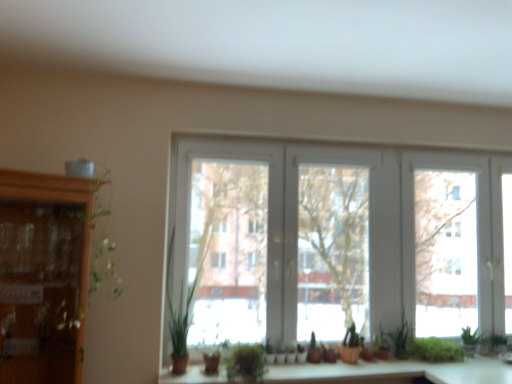
Identify the location of matte wood counter top at center. Image resolution: width=512 pixels, height=384 pixels. (394, 372).

Measure the distance between green leafy plant at center, which ranks as the sixth plant in right-to-left order, and camera.

green leafy plant at center, which ranks as the sixth plant in right-to-left order, is 8.16 feet away from camera.

How much space does green matte plant at lower right, marked as the second plant in a right-to-left arrangement, occupy vertically?

green matte plant at lower right, marked as the second plant in a right-to-left arrangement, is 13.49 inches in height.

In order to face green matte plant at lower right, acting as the fifth plant starting from the left, should I rotate leftwards or rightwards?

You should look right and rotate roughly 18.867 degrees.

Image resolution: width=512 pixels, height=384 pixels. In order to click on green matte plant at lower right, which appears as the 3th plant when viewed from the right in this screenshot , I will do `click(381, 344)`.

In the scene shown: What is the approximate height of green matte plant at lower right, which appears as the 3th plant when viewed from the right?

green matte plant at lower right, which appears as the 3th plant when viewed from the right, is 9.41 inches tall.

At what (x,y) coordinates should I click in order to perform the action: click on green matte plant at center, which appears as the 4th plant when viewed from the right. Please return your answer as a coordinate pair (x, y). The height and width of the screenshot is (384, 512). Looking at the image, I should click on (328, 354).

Describe the element at coordinates (436, 350) in the screenshot. I see `green leafy plant at lower right, which appears as the sixth plant when viewed from the left` at that location.

You are a GUI agent. You are given a task and a screenshot of the screen. Output one action in this format:
    pyautogui.click(x=<x>, y=<y>)
    Task: Click on the matte wood counter top at center
    This screenshot has width=512, height=384.
    Given the screenshot: What is the action you would take?
    pyautogui.click(x=394, y=372)

What's the angular difference between white plastic window at center and green matte plant at center, positioned as the third plant in left-to-right order,'s facing directions?

The angle between the facing direction of white plastic window at center and the facing direction of green matte plant at center, positioned as the third plant in left-to-right order, is 0.00143 degrees.

Considering the relative sizes of white plastic window at center and green matte plant at center, positioned as the third plant in left-to-right order, in the image provided, is white plastic window at center bigger than green matte plant at center, positioned as the third plant in left-to-right order,?

Yes, white plastic window at center is bigger than green matte plant at center, positioned as the third plant in left-to-right order.

Locate an element on the screen. This screenshot has height=384, width=512. the 6th plant below the white plastic window at center (from a real-world perspective) is located at coordinates (328, 354).

Looking at this image, do you think white plastic window at center is within green matte plant at center, the fifth plant in the right-to-left sequence, or outside of it?

white plastic window at center lies outside green matte plant at center, the fifth plant in the right-to-left sequence.

Which object is positioned more to the left, white plastic window at center or green matte plant at center, which ranks as the 2th plant in left-to-right order?

Positioned to the left is green matte plant at center, which ranks as the 2th plant in left-to-right order.

Is white plastic window at center bigger or smaller than green matte plant at center, which ranks as the 2th plant in left-to-right order?

In the image, white plastic window at center appears to be larger than green matte plant at center, which ranks as the 2th plant in left-to-right order.

From a real-world perspective, who is located lower, white plastic window at center or green matte plant at center, which ranks as the 2th plant in left-to-right order?

In real-world perspective, green matte plant at center, which ranks as the 2th plant in left-to-right order, is lower.

Looking at this image, could you tell me if white plastic window at center is facing green matte plant at center?

Yes, white plastic window at center is oriented towards green matte plant at center.

From a real-world perspective, which is physically below, white plastic window at center or green matte plant at center?

green matte plant at center.

Considering their positions, is white plastic window at center located in front of or behind green matte plant at center?

In the image, white plastic window at center appears behind green matte plant at center.

Does green matte plant at lower right, which appears as the 3th plant when viewed from the right, have a greater width compared to green matte plant at center?

In fact, green matte plant at lower right, which appears as the 3th plant when viewed from the right, might be narrower than green matte plant at center.

Is point (382, 328) closer to viewer compared to point (243, 358)?

No, it is not.

Is green matte plant at center inside green matte plant at lower right, which appears as the 3th plant when viewed from the right?

No, green matte plant at center is located outside of green matte plant at lower right, which appears as the 3th plant when viewed from the right.

What's the angular difference between green matte plant at center and green leafy plant at lower right, arranged as the 1th plant when viewed from the right,'s facing directions?

green matte plant at center and green leafy plant at lower right, arranged as the 1th plant when viewed from the right, are facing 0.000227 degrees away from each other.

From the image's perspective, is green matte plant at center under green leafy plant at lower right, which appears as the sixth plant when viewed from the left?

No, from the image's perspective, green matte plant at center is not below green leafy plant at lower right, which appears as the sixth plant when viewed from the left.

Which is more to the right, green matte plant at center or green leafy plant at lower right, arranged as the 1th plant when viewed from the right?

green leafy plant at lower right, arranged as the 1th plant when viewed from the right, is more to the right.

Starting from the green matte plant at center, which plant is the 5th one to the right? Please provide its 2D coordinates.

[(436, 350)]

From the image's perspective, is green matte plant at center, positioned as the third plant in left-to-right order, positioned above or below green matte plant at lower right, acting as the fifth plant starting from the left?

Clearly, from the image's perspective, green matte plant at center, positioned as the third plant in left-to-right order, is below green matte plant at lower right, acting as the fifth plant starting from the left.

Image resolution: width=512 pixels, height=384 pixels. I want to click on plant that is the 2nd object located in front of the green matte plant at lower right, marked as the second plant in a right-to-left arrangement, so click(x=328, y=354).

Would you say green matte plant at center, positioned as the third plant in left-to-right order, is outside green matte plant at lower right, marked as the second plant in a right-to-left arrangement?

Yes.

Is green matte plant at center, positioned as the third plant in left-to-right order, not near green matte plant at lower right, marked as the second plant in a right-to-left arrangement?

That's not correct — green matte plant at center, positioned as the third plant in left-to-right order, is a little close to green matte plant at lower right, marked as the second plant in a right-to-left arrangement.

Is green leafy plant at center, which ranks as the sixth plant in right-to-left order, aimed at green matte plant at center, positioned as the third plant in left-to-right order?

No, green leafy plant at center, which ranks as the sixth plant in right-to-left order, is not oriented towards green matte plant at center, positioned as the third plant in left-to-right order.

Does point (187, 333) appear closer or farther from the camera than point (331, 358)?

Point (187, 333) appears to be closer to the viewer than point (331, 358).

Does green leafy plant at center, which ranks as the sixth plant in right-to-left order, have a smaller size compared to green matte plant at center, which appears as the 4th plant when viewed from the right?

No.

From the image's perspective, which is below, green leafy plant at center, the first plant in the left-to-right sequence, or green matte plant at center, positioned as the third plant in left-to-right order?

green matte plant at center, positioned as the third plant in left-to-right order, appears lower in the image.

Image resolution: width=512 pixels, height=384 pixels. I want to click on window located in front of the green matte plant at center, which appears as the 4th plant when viewed from the right, so click(x=337, y=241).

Identify the location of window above the green matte plant at center, the fifth plant in the right-to-left sequence (from the image's perspective). This screenshot has height=384, width=512. tap(337, 241).

When comparing their distances from wooden cabinet at left, does green matte plant at center, which appears as the 4th plant when viewed from the right, or green leafy plant at lower right, arranged as the 1th plant when viewed from the right, seem further?

green leafy plant at lower right, arranged as the 1th plant when viewed from the right, lies further to wooden cabinet at left than the other object.

Looking at the image, which one is located closer to white plastic window at center, green matte plant at lower right, marked as the second plant in a right-to-left arrangement, or green matte plant at lower right, acting as the 4th plant starting from the left?

green matte plant at lower right, marked as the second plant in a right-to-left arrangement, is closer to white plastic window at center.

Looking at the image, which one is located closer to matte wood counter top at center, green leafy plant at center, the first plant in the left-to-right sequence, or white plastic window at center?

Based on the image, white plastic window at center appears to be nearer to matte wood counter top at center.

Looking at the image, which one is located closer to white plastic window at center, green matte plant at center or green matte plant at lower right, acting as the fifth plant starting from the left?

green matte plant at lower right, acting as the fifth plant starting from the left.

Considering their positions, is green matte plant at lower right, marked as the second plant in a right-to-left arrangement, positioned closer to green matte plant at center, which appears as the 4th plant when viewed from the right, than green leafy plant at lower right, which appears as the sixth plant when viewed from the left?

Based on the image, green matte plant at lower right, marked as the second plant in a right-to-left arrangement, appears to be nearer to green matte plant at center, which appears as the 4th plant when viewed from the right.

Based on the photo, from the image, which object appears to be nearer to green matte plant at center, which ranks as the 2th plant in left-to-right order, green matte plant at lower right, which appears as the 3th plant when viewed from the right, or green matte plant at center?

Based on the image, green matte plant at lower right, which appears as the 3th plant when viewed from the right, appears to be nearer to green matte plant at center, which ranks as the 2th plant in left-to-right order.

Estimate the real-world distances between objects in this image. Which object is closer to green leafy plant at center, the first plant in the left-to-right sequence, wooden cabinet at left or green leafy plant at lower right, which appears as the sixth plant when viewed from the left?

Among the two, wooden cabinet at left is located nearer to green leafy plant at center, the first plant in the left-to-right sequence.

Considering their positions, is green matte plant at center, positioned as the third plant in left-to-right order, positioned further to green matte plant at center, the fifth plant in the right-to-left sequence, than wooden cabinet at left?

The object further to green matte plant at center, the fifth plant in the right-to-left sequence, is wooden cabinet at left.

This screenshot has height=384, width=512. I want to click on plant located between wooden cabinet at left and matte wood counter top at center in the left-right direction, so click(x=179, y=308).

Where is `counter top between green matte plant at center and green matte plant at center, the fifth plant in the right-to-left sequence`? The width and height of the screenshot is (512, 384). counter top between green matte plant at center and green matte plant at center, the fifth plant in the right-to-left sequence is located at coordinates (394, 372).

The height and width of the screenshot is (384, 512). What are the coordinates of `counter top located between wooden cabinet at left and green matte plant at center, which appears as the 4th plant when viewed from the right, in the left-right direction` in the screenshot? It's located at (394, 372).

Identify the location of window between green leafy plant at center, the first plant in the left-to-right sequence, and green leafy plant at lower right, which appears as the sixth plant when viewed from the left. This screenshot has height=384, width=512. (337, 241).